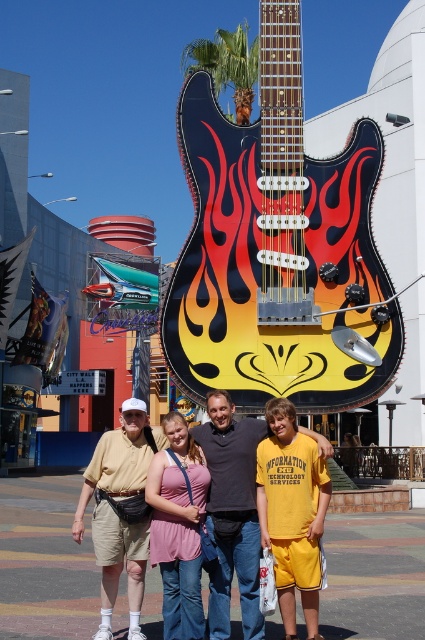
You are a fashion designer observing the group of four people in front of the guitar sculpture. You notice two individuals wearing shorts at the center. Which of the two, the matte khaki shorts at center or the matte yellow shorts at center, is positioned lower on their body?

The matte khaki shorts at center is below matte yellow shorts at center, so the matte khaki shorts at center is positioned lower on their body.